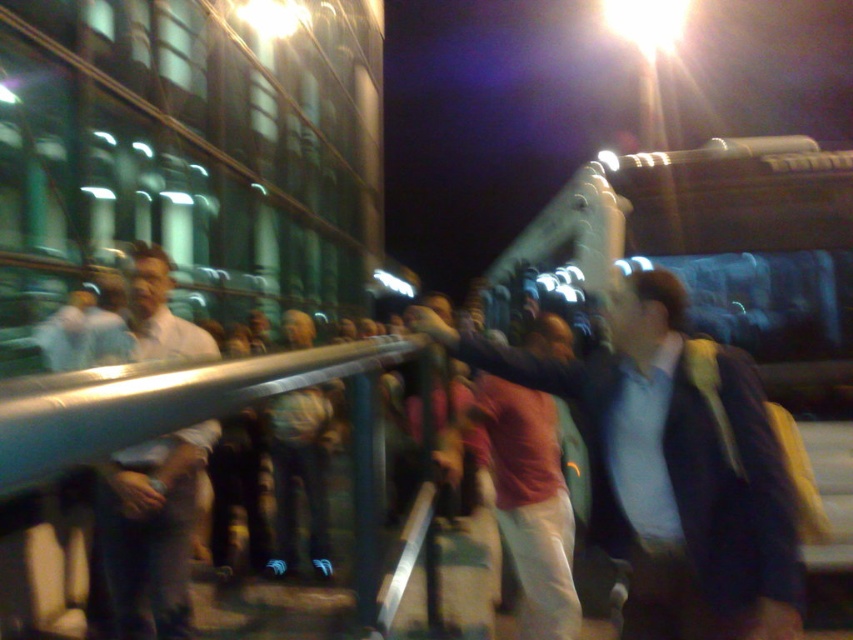
Can you confirm if white shirt at left is smaller than denim pants at center?

Correct, white shirt at left occupies less space than denim pants at center.

Can you confirm if white shirt at left is bigger than denim pants at center?

No.

Between point (152, 605) and point (286, 518), which one is positioned behind?

Point (286, 518)

Identify the location of white shirt at left. Image resolution: width=853 pixels, height=640 pixels. (151, 531).

Is blue fabric jacket at center shorter than denim pants at center?

Indeed, blue fabric jacket at center has a lesser height compared to denim pants at center.

In the scene shown: Between blue fabric jacket at center and denim pants at center, which one is positioned higher?

Positioned higher is blue fabric jacket at center.

Between point (752, 524) and point (329, 548), which one is positioned behind?

Positioned behind is point (329, 548).

Where is `blue fabric jacket at center`? This screenshot has height=640, width=853. blue fabric jacket at center is located at coordinates (671, 468).

Based on the photo, who is higher up, blue fabric jacket at center or light blue shirt at center?

blue fabric jacket at center

Does blue fabric jacket at center appear over light blue shirt at center?

Yes.

I want to click on blue fabric jacket at center, so click(671, 468).